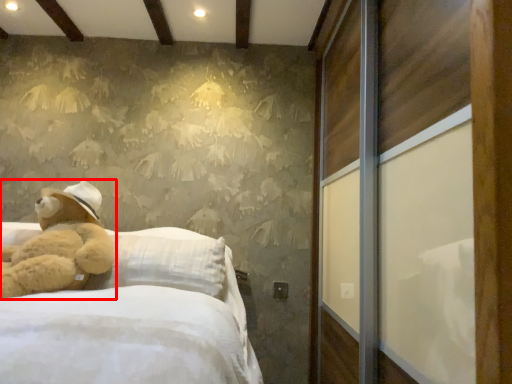
Question: From the image's perspective, what is the correct spatial relationship of teddy bear (annotated by the red box) in relation to screen door?

Choices:
 (A) above
 (B) below

Answer: (B)